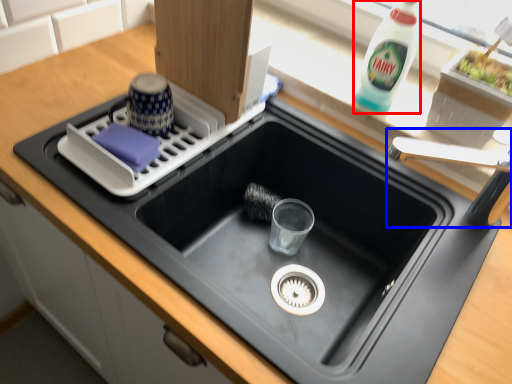
Question: Which point is closer to the camera, bottle (highlighted by a red box) or faucet (highlighted by a blue box)?

Choices:
 (A) bottle
 (B) faucet

Answer: (B)